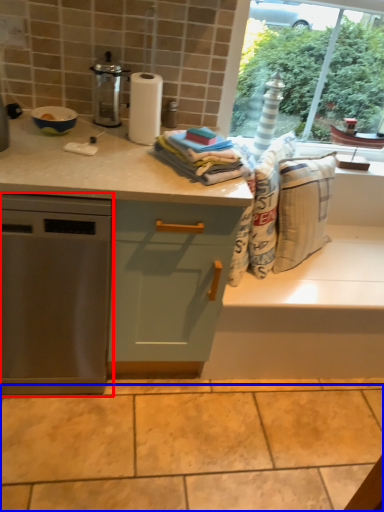
Question: Which of the following is the farthest to the observer, home appliance (highlighted by a red box) or granite (highlighted by a blue box)?

Choices:
 (A) home appliance
 (B) granite

Answer: (B)